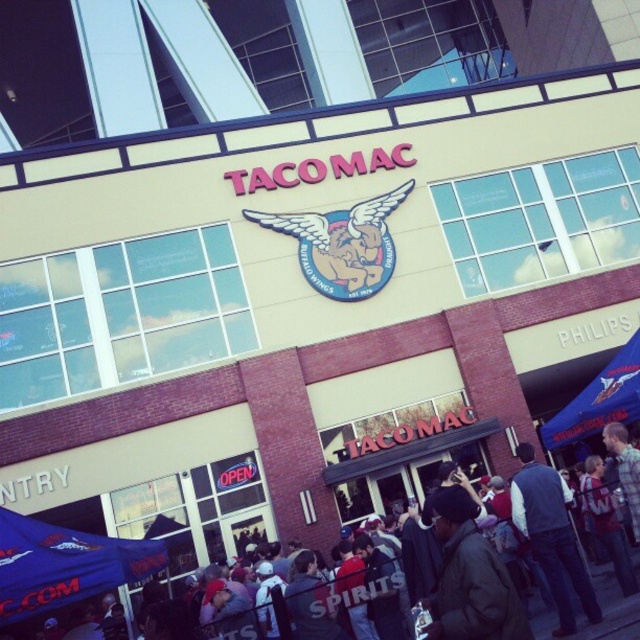
Question: Is blue fabric canopy at lower left above blue fabric canopy at center?

Choices:
 (A) no
 (B) yes

Answer: (A)

Question: Which object appears farthest from the camera in this image?

Choices:
 (A) dark gray jacket at center
 (B) blue fabric canopy at center

Answer: (B)

Question: Is blue fabric canopy at center below dark gray jacket at center?

Choices:
 (A) no
 (B) yes

Answer: (A)

Question: Where is blue fabric canopy at lower left located in relation to dark gray jacket at center in the image?

Choices:
 (A) left
 (B) right

Answer: (A)

Question: Based on their relative distances, which object is nearer to the dark brown jacket at center?

Choices:
 (A) blue fabric canopy at center
 (B) dark gray jacket at center
 (C) blue fabric canopy at lower left
 (D) dark blue vest at center

Answer: (D)

Question: Which point is closer to the camera taking this photo?

Choices:
 (A) (74, 573)
 (B) (563, 481)
 (C) (321, 528)
 (D) (436, 632)

Answer: (D)